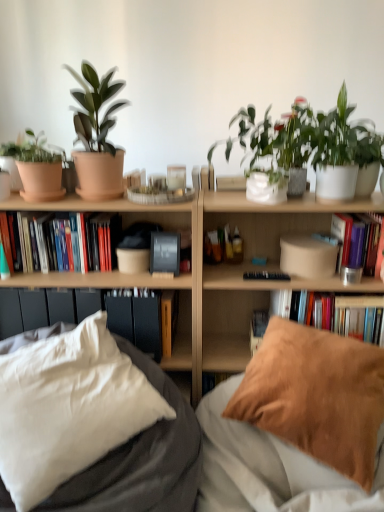
Question: Is hardcover book at upper right, the 1th book in the right-to-left sequence, surrounded by brown suede pillow at lower right, the first pillow when ordered from right to left?

Choices:
 (A) yes
 (B) no

Answer: (B)

Question: Does brown suede pillow at lower right, which is the second pillow from left to right, have a greater width compared to hardcover book at upper right, the third book from the left?

Choices:
 (A) yes
 (B) no

Answer: (A)

Question: Can you confirm if brown suede pillow at lower right, the first pillow when ordered from right to left, is shorter than hardcover book at upper right, the 1th book in the right-to-left sequence?

Choices:
 (A) yes
 (B) no

Answer: (B)

Question: From a real-world perspective, is brown suede pillow at lower right, the first pillow when ordered from right to left, on hardcover book at upper right, the 1th book in the right-to-left sequence?

Choices:
 (A) no
 (B) yes

Answer: (A)

Question: Is brown suede pillow at lower right, which is the second pillow from left to right, aimed at hardcover book at upper right, the 1th book in the right-to-left sequence?

Choices:
 (A) yes
 (B) no

Answer: (B)

Question: From the image's perspective, is wooden paperback book at center, the first paperback book ordered from the bottom, located above or below black matte book at center, placed as the 2th paperback book when sorted from bottom to top?

Choices:
 (A) above
 (B) below

Answer: (B)

Question: From a real-world perspective, is wooden paperback book at center, the 3th paperback book viewed from the top, physically located above or below black matte book at center, placed as the 2th paperback book when sorted from bottom to top?

Choices:
 (A) above
 (B) below

Answer: (B)

Question: Is wooden paperback book at center, the 3th paperback book viewed from the top, inside or outside of black matte book at center, placed as the 2th paperback book when sorted from bottom to top?

Choices:
 (A) inside
 (B) outside

Answer: (B)

Question: Relative to black matte book at center, which is counted as the second paperback book, starting from the top, is wooden paperback book at center, the first paperback book ordered from the bottom, in front or behind?

Choices:
 (A) front
 (B) behind

Answer: (B)

Question: Is matte terracotta pot at upper left, the second houseplant from the left, to the left or to the right of hardcover book at upper right, the second book when ordered from right to left, in the image?

Choices:
 (A) right
 (B) left

Answer: (B)

Question: In terms of height, does matte terracotta pot at upper left, which ranks as the 2th houseplant in right-to-left order, look taller or shorter compared to hardcover book at upper right, the second book when ordered from right to left?

Choices:
 (A) tall
 (B) short

Answer: (A)

Question: From the image's perspective, relative to hardcover book at upper right, the 2th book when ordered from left to right, is matte terracotta pot at upper left, which ranks as the 2th houseplant in right-to-left order, above or below?

Choices:
 (A) above
 (B) below

Answer: (A)

Question: Does point (62, 66) appear closer or farther from the camera than point (372, 342)?

Choices:
 (A) farther
 (B) closer

Answer: (A)

Question: Considering the positions of brown suede pillow at lower right, the first pillow when ordered from right to left, and matte clay pot at left, acting as the first flowerpot starting from the top, in the image, is brown suede pillow at lower right, the first pillow when ordered from right to left, taller or shorter than matte clay pot at left, acting as the first flowerpot starting from the top,?

Choices:
 (A) tall
 (B) short

Answer: (A)

Question: Is point (334, 377) positioned closer to the camera than point (34, 178)?

Choices:
 (A) closer
 (B) farther

Answer: (A)